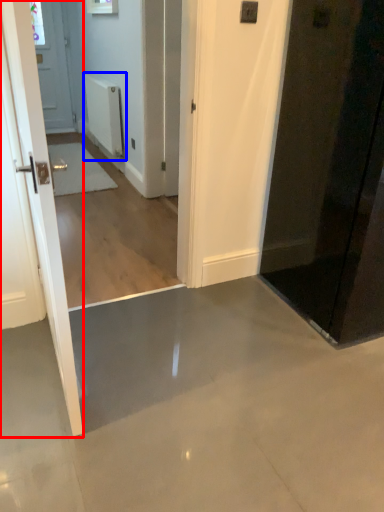
Question: Which object appears closest to the camera in this image, door (highlighted by a red box) or radiator (highlighted by a blue box)?

Choices:
 (A) door
 (B) radiator

Answer: (A)